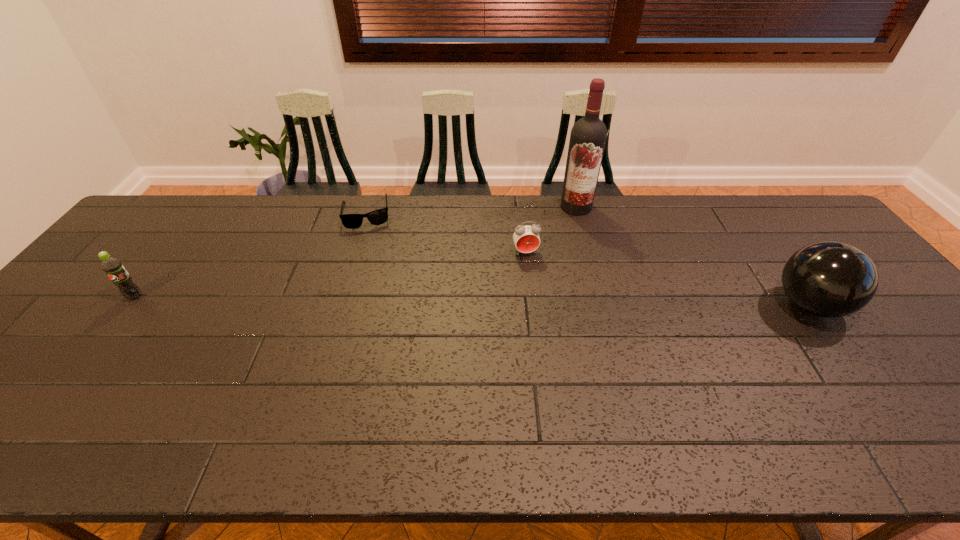
Where is `free space on the desktop that is between the third shortest object and the bowling ball and is positioned on the label of the wine bottle`? free space on the desktop that is between the third shortest object and the bowling ball and is positioned on the label of the wine bottle is located at coordinates (518, 302).

The image size is (960, 540). I want to click on free space on the desktop that is between the leftmost object and the bowling ball and is positioned on the front-facing side of the sunglasses, so click(x=380, y=300).

I want to click on vacant spot on the desktop that is between the third tallest object and the rightmost object and is positioned on the face of the second shortest object, so click(x=539, y=302).